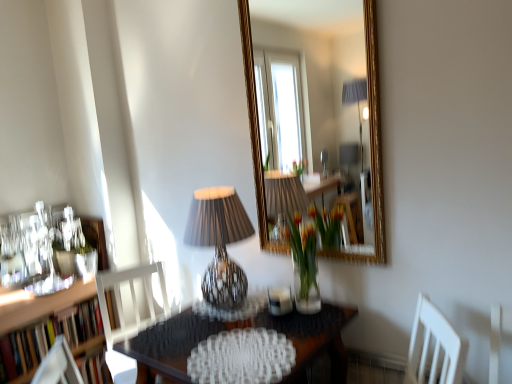
Image resolution: width=512 pixels, height=384 pixels. What do you see at coordinates (47, 338) in the screenshot?
I see `wooden bookshelf at left` at bounding box center [47, 338].

Image resolution: width=512 pixels, height=384 pixels. What do you see at coordinates (132, 305) in the screenshot?
I see `white wood chair at lower left` at bounding box center [132, 305].

The image size is (512, 384). What do you see at coordinates (310, 252) in the screenshot?
I see `translucent glass vase at center` at bounding box center [310, 252].

Measure the distance between point (x=297, y=379) and camera.

Point (x=297, y=379) is 4.96 feet from camera.

What do you see at coordinates (313, 338) in the screenshot? The width and height of the screenshot is (512, 384). I see `wooden table at center` at bounding box center [313, 338].

Measure the distance between point (101, 246) and camera.

Point (101, 246) and camera are 8.25 feet apart from each other.

In order to click on matte black picture frame at left in this screenshot , I will do [96, 239].

The height and width of the screenshot is (384, 512). Find the location of `matte black lampshade at center`. matte black lampshade at center is located at coordinates (219, 243).

Is translucent glass vase at center further to the viewer compared to matte black picture frame at left?

No, translucent glass vase at center is closer to the viewer.

From the image's perspective, which is below, translucent glass vase at center or matte black picture frame at left?

matte black picture frame at left is shown below in the image.

Does translucent glass vase at center turn towards matte black picture frame at left?

No, translucent glass vase at center is not aimed at matte black picture frame at left.

Choose the correct answer: Is wooden table at center inside matte black lampshade at center or outside it?

wooden table at center exists outside the volume of matte black lampshade at center.

From the image's perspective, does wooden table at center appear lower than matte black lampshade at center?

Yes, from the image's perspective, wooden table at center is below matte black lampshade at center.

Is wooden table at center aimed at matte black lampshade at center?

No, wooden table at center is not oriented towards matte black lampshade at center.

Is matte black picture frame at left completely or partially inside white wood chair at lower left?

That's incorrect, matte black picture frame at left is not inside white wood chair at lower left.

Where is `chair that appears below the matte black picture frame at left (from a real-world perspective)`? The image size is (512, 384). chair that appears below the matte black picture frame at left (from a real-world perspective) is located at coordinates (132, 305).

Considering the relative sizes of white wood chair at lower left and matte black picture frame at left in the image provided, is white wood chair at lower left shorter than matte black picture frame at left?

No.

Could you tell me if white wood chair at lower left is facing matte black picture frame at left?

No, white wood chair at lower left is not aimed at matte black picture frame at left.

Is matte black picture frame at left not within white wood chair at lower left?

Indeed, matte black picture frame at left is completely outside white wood chair at lower left.

Which object is further away from the camera taking this photo, matte black picture frame at left or white wood chair at lower left?

matte black picture frame at left is further from the camera.

From the image's perspective, is matte black picture frame at left located above or below white wood chair at lower left?

matte black picture frame at left is situated higher than white wood chair at lower left in the image.

From a real-world perspective, is matte black picture frame at left located higher than white wood chair at lower left?

Yes, from a real-world perspective, matte black picture frame at left is on top of white wood chair at lower left.

From a real-world perspective, is wooden bookshelf at left located higher than translucent glass vase at center?

No.

What's the angular difference between wooden bookshelf at left and translucent glass vase at center's facing directions?

There is a 91.4-degree angle between the facing directions of wooden bookshelf at left and translucent glass vase at center.

Is wooden bookshelf at left directly adjacent to translucent glass vase at center?

No.

Which point is more forward, [31,350] or [302,288]?

The point [302,288] is in front.

Would you say wooden bookshelf at left is part of wooden table at center's contents?

No, wooden table at center does not contain wooden bookshelf at left.

Find the location of a particular element. bookcase below the wooden table at center (from the image's perspective) is located at coordinates (47, 338).

Is the surface of wooden table at center in direct contact with wooden bookshelf at left?

They are not placed beside each other.

What's the angular difference between wooden table at center and wooden bookshelf at left's facing directions?

The angle between the facing direction of wooden table at center and the facing direction of wooden bookshelf at left is 90.4 degrees.

From the image's perspective, which is above, white wood chair at lower left or translucent glass vase at center?

translucent glass vase at center.

Is translucent glass vase at center at the back of white wood chair at lower left?

→ No, translucent glass vase at center is not at the back of white wood chair at lower left.

How many degrees apart are the facing directions of white wood chair at lower left and translucent glass vase at center?

There is a 66.1-degree angle between the facing directions of white wood chair at lower left and translucent glass vase at center.

This screenshot has height=384, width=512. I want to click on floral arrangement in front of the matte black picture frame at left, so click(310, 252).

What are the coordinates of `table located on the right of matte black lampshade at center` in the screenshot? It's located at point(313,338).

Looking at the image, which one is located further to white wood chair at lower left, matte black lampshade at center or wooden table at center?

matte black lampshade at center lies further to white wood chair at lower left than the other object.

In the scene shown: Based on their spatial positions, is wooden table at center or white wood chair at lower left further from wooden bookshelf at left?

wooden table at center lies further to wooden bookshelf at left than the other object.

Based on their spatial positions, is matte black picture frame at left or translucent glass vase at center further from matte black lampshade at center?

matte black picture frame at left is further to matte black lampshade at center.

Looking at the image, which one is located closer to matte black picture frame at left, matte black lampshade at center or wooden bookshelf at left?

Among the two, wooden bookshelf at left is located nearer to matte black picture frame at left.

From the picture: Which object lies nearer to the anchor point wooden bookshelf at left, matte black picture frame at left or translucent glass vase at center?

matte black picture frame at left is closer to wooden bookshelf at left.

Estimate the real-world distances between objects in this image. Which object is further from wooden table at center, wooden bookshelf at left or white wood chair at lower left?

Based on the image, wooden bookshelf at left appears to be further to wooden table at center.

From the image, which object appears to be farther from matte black lampshade at center, white wood chair at lower left or translucent glass vase at center?

white wood chair at lower left.

Based on their spatial positions, is wooden bookshelf at left or translucent glass vase at center closer to white wood chair at lower left?

wooden bookshelf at left is positioned closer to the anchor white wood chair at lower left.

In order to click on table lamp between white wood chair at lower left and translucent glass vase at center in this screenshot , I will do `click(219, 243)`.

Where is `table situated between wooden bookshelf at left and translucent glass vase at center from left to right`? This screenshot has height=384, width=512. table situated between wooden bookshelf at left and translucent glass vase at center from left to right is located at coordinates (313, 338).

Locate an element on the screen. chair between wooden bookshelf at left and translucent glass vase at center in the horizontal direction is located at coordinates (132, 305).

I want to click on chair situated between wooden bookshelf at left and wooden table at center from left to right, so click(132, 305).